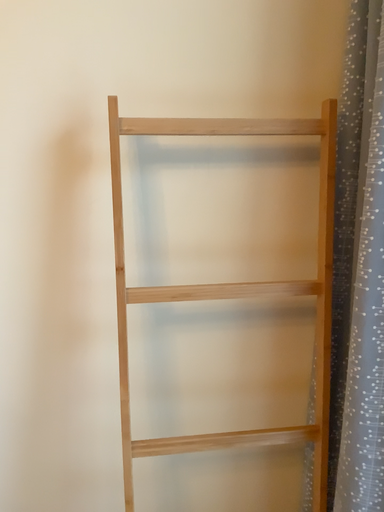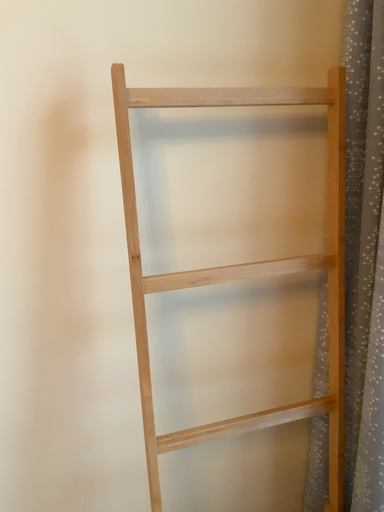
Question: How did the camera likely rotate when shooting the video?

Choices:
 (A) rotated left
 (B) rotated right

Answer: (B)